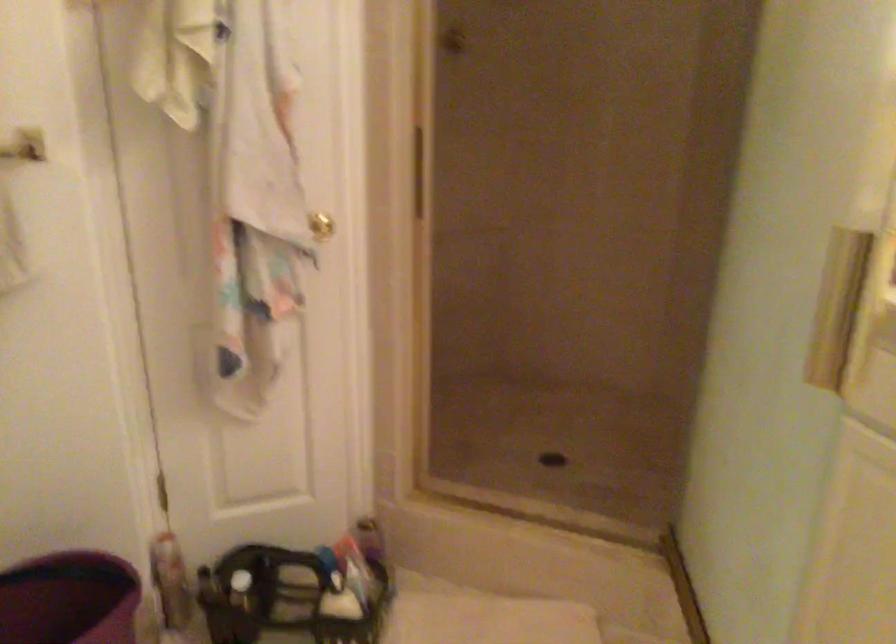
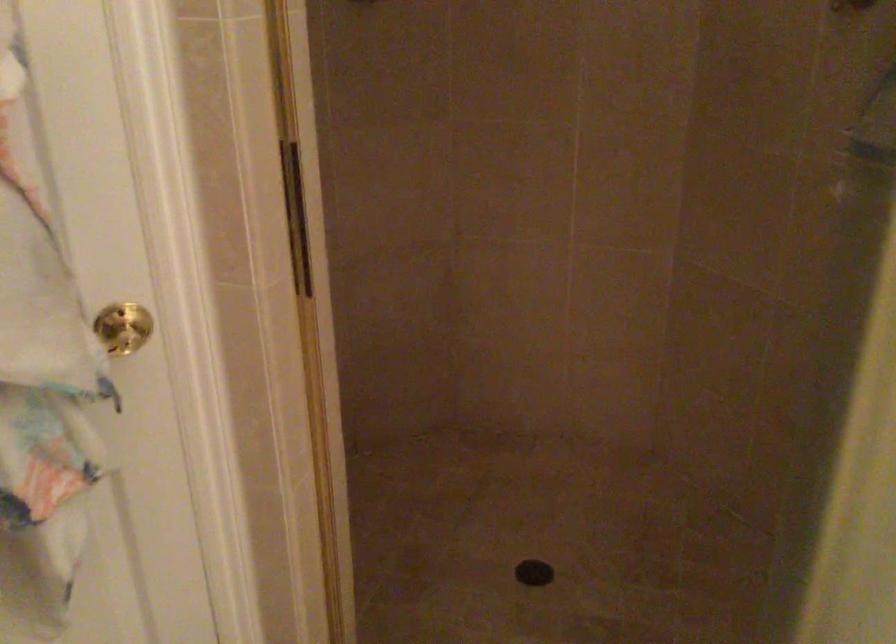
In the second image, find the point that corresponds to (315,218) in the first image.

(123, 328)